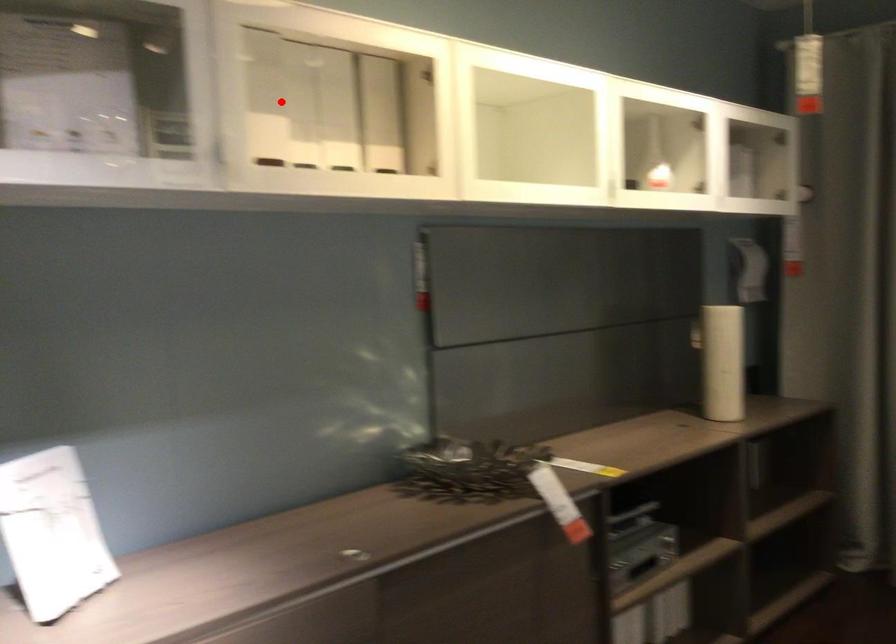
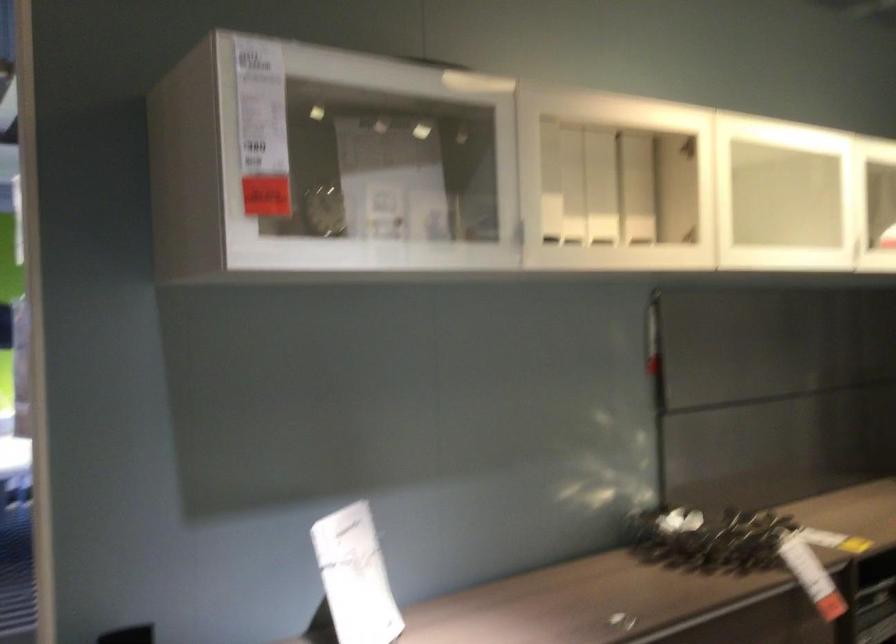
Find the pixel in the second image that matches the highlighted location in the first image.

(549, 182)